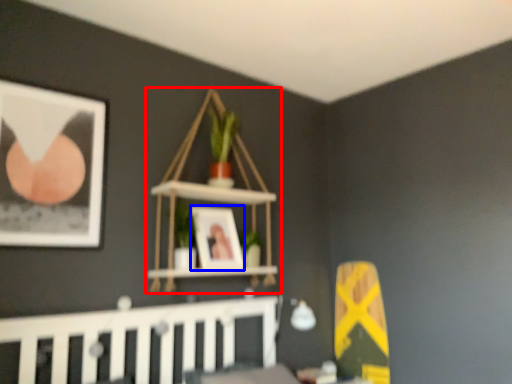
Question: Which of the following is the farthest to the observer, shelf (highlighted by a red box) or picture frame (highlighted by a blue box)?

Choices:
 (A) shelf
 (B) picture frame

Answer: (B)